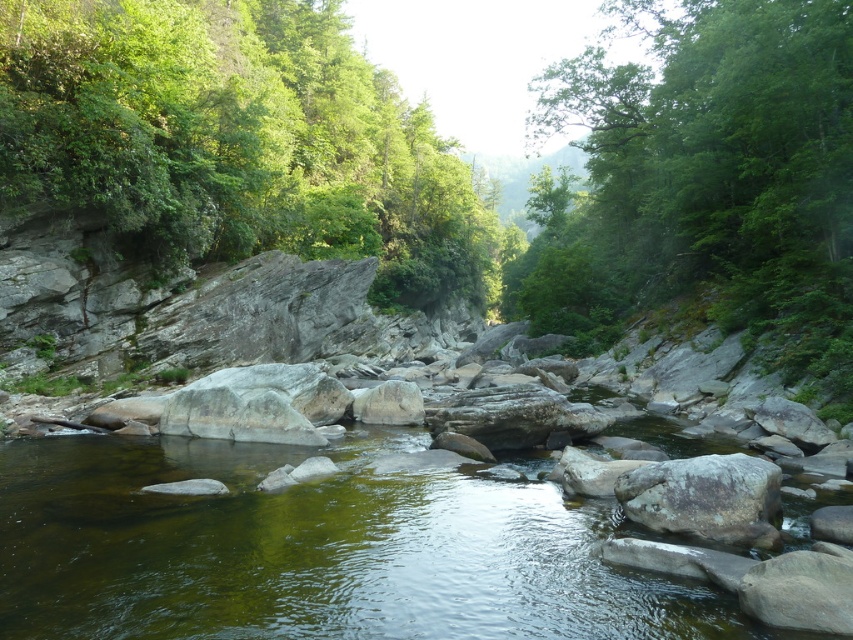
You are standing at the riverbank and want to reach the gray rough rock at center. There is a green leafy tree at upper left blocking your path. Can you walk directly to the rock without going around the tree?

The green leafy tree at upper left is above the gray rough rock at center, so the tree is not blocking the path. You can walk directly to the gray rough rock at center without going around the tree.

You are standing at the center of the river and looking towards the green leafy tree at upper left. In which direction should you move to reach it?

The green leafy tree at upper left is located at point (239, 141), so you should move towards the upper left direction to reach it.

You are an ecologist studying the river ecosystem. You need to determine which object occupies more horizontal space in the image for your report. Which is wider in the image, the green leafy tree at upper left or the gray rough rock at center?

The green leafy tree at upper left might be wider than gray rough rock at center according to the description provided.